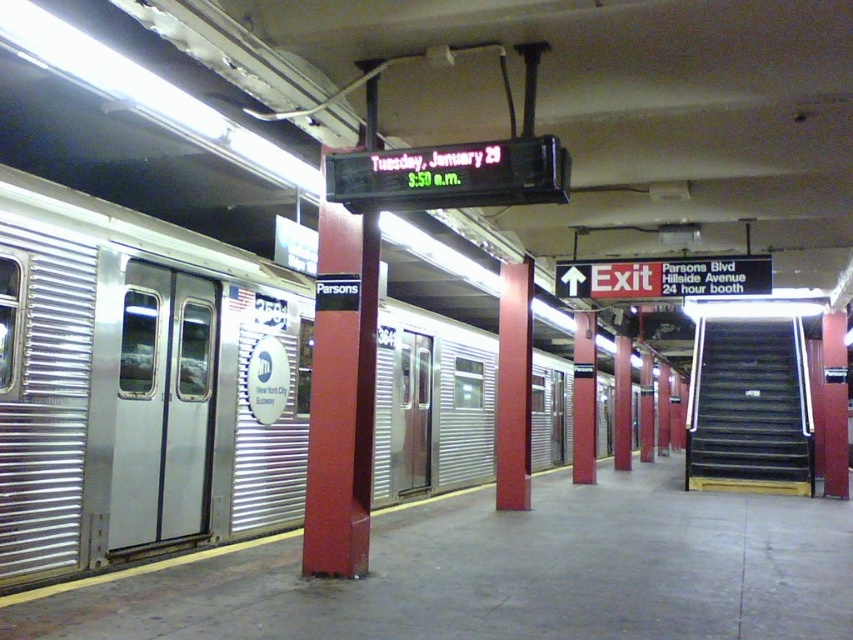
Can you confirm if silver metallic train at left is positioned to the right of black metal stairs at right?

Incorrect, silver metallic train at left is not on the right side of black metal stairs at right.

Who is taller, silver metallic train at left or black metal stairs at right?

With more height is silver metallic train at left.

Is point (15, 378) positioned behind point (717, 356)?

No, (15, 378) is closer to viewer.

The width and height of the screenshot is (853, 640). In order to click on silver metallic train at left in this screenshot , I will do `click(140, 385)`.

Who is taller, silver metallic train at left or metallic red pillar at center?

With more height is silver metallic train at left.

Is silver metallic train at left bigger than metallic red pillar at center?

Yes.

Who is more distant from viewer, [196,449] or [503,460]?

Positioned behind is point [503,460].

Where is `silver metallic train at left`? This screenshot has height=640, width=853. silver metallic train at left is located at coordinates (140, 385).

Is black metal stairs at right further to the viewer compared to metallic red pillar at center?

That is True.

Is black metal stairs at right smaller than metallic red pillar at center?

Actually, black metal stairs at right might be larger than metallic red pillar at center.

Is point (795, 374) positioned after point (518, 312)?

That is True.

Locate an element on the screen. black metal stairs at right is located at coordinates (749, 406).